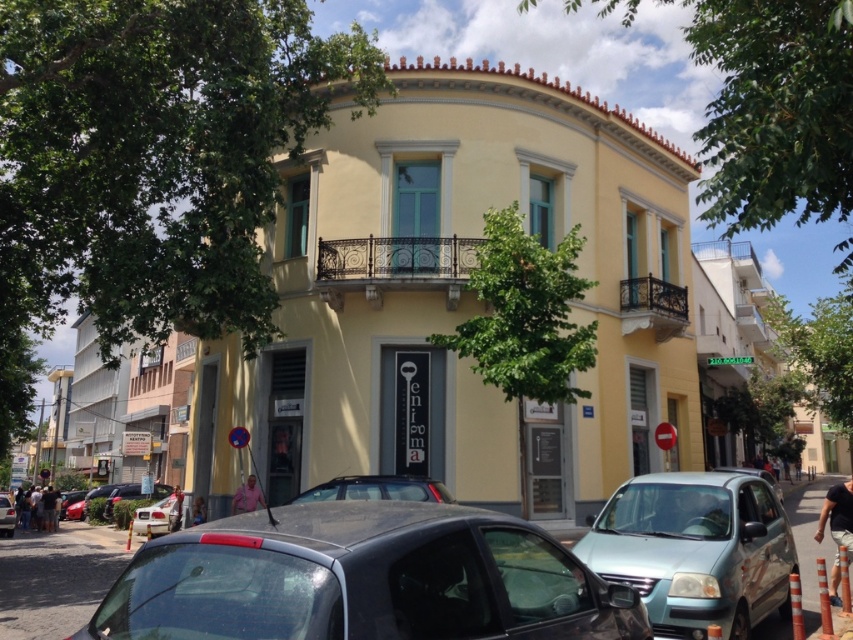
Does light blue metallic car at lower right have a lesser width compared to silver metallic car at lower left?

In fact, light blue metallic car at lower right might be wider than silver metallic car at lower left.

Does light blue metallic car at lower right appear on the right side of silver metallic car at lower left?

Correct, you'll find light blue metallic car at lower right to the right of silver metallic car at lower left.

Between point (641, 572) and point (149, 512), which one is positioned in front?

Point (641, 572) is in front.

You are a GUI agent. You are given a task and a screenshot of the screen. Output one action in this format:
    pyautogui.click(x=<x>, y=<y>)
    Task: Click on the light blue metallic car at lower right
    
    Given the screenshot: What is the action you would take?
    pyautogui.click(x=695, y=550)

Who is more distant from viewer, (276, 508) or (740, 628)?

Positioned behind is point (740, 628).

From the picture: Can you confirm if shiny black car at center is positioned below light blue metallic car at lower right?

No, shiny black car at center is not below light blue metallic car at lower right.

Identify the location of shiny black car at center. The height and width of the screenshot is (640, 853). (363, 579).

Between shiny black car at center and matte black car at lower left, which one is positioned lower?

Positioned lower is matte black car at lower left.

Between shiny black car at center and matte black car at lower left, which one appears on the right side from the viewer's perspective?

Positioned to the right is shiny black car at center.

Is point (120, 621) behind point (9, 513)?

No, it is in front of (9, 513).

I want to click on shiny black car at center, so click(x=363, y=579).